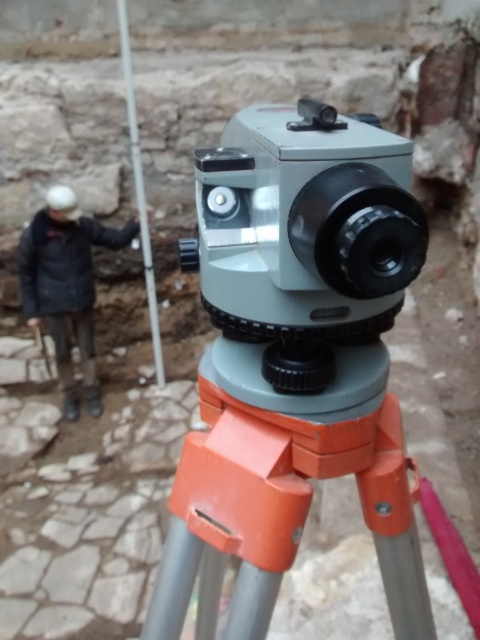
You are setting up equipment for a construction site safety inspection. You have a matte gray video camera at center and a metallic pole at upper left. Which object takes up more space in the scene?

The metallic pole at upper left takes up more space in the scene than the matte gray video camera at center because the matte gray video camera at center occupies less space than metallic pole at upper left.

You are a construction worker holding a 30 inch long tool. You want to place it on the orange plastic tripod at center. Can you fit the entire tool on the tripod without bending it?

The orange plastic tripod at center is 28.67 inches away from the camera, so the tool is longer than the distance between the tripod and the camera. However, the question is about fitting the tool on the tripod, not the distance from the camera. Since the tripod itself is an object, the length of the tool compared to the tripod is not specified. Therefore, it is unclear if the 30 inch tool can fit on the tripod without bending it based on the given information.

You are standing in front of the total station on the orange tripod. You see two points marked on the ground, point [237,252] and point [245,449]. Which point is nearer to you?

Point [237,252] is closer to the viewer than point [245,449].